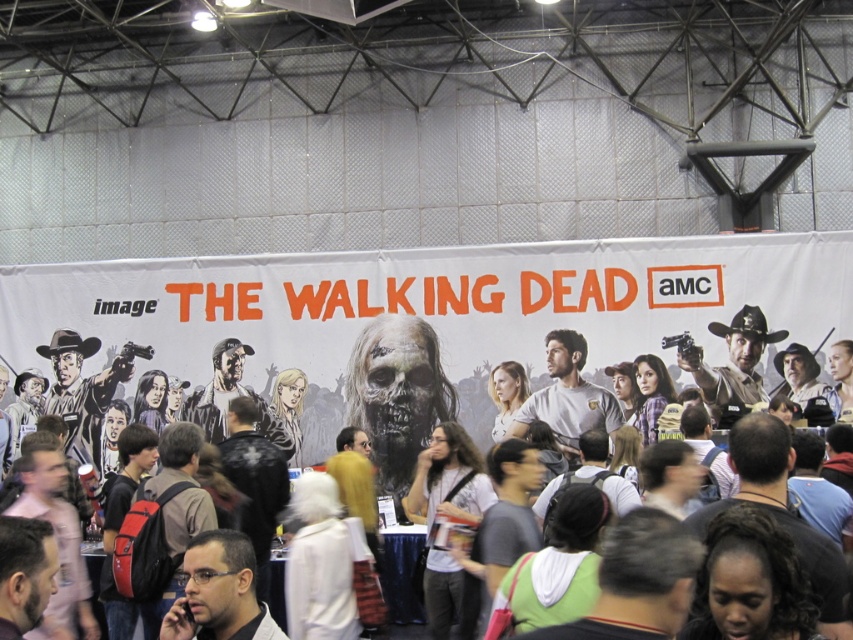
In the scene shown: You are a photographer at the event and want to capture both the white matte banner at center and the matte black backpack at center in the same frame. Which object should you position closer to the camera to ensure both are fully visible?

The white matte banner at center has a lesser height compared to the matte black backpack at center. To ensure both are fully visible in the frame, position the white matte banner at center closer to the camera since it is smaller in height and needs to be enlarged in the photo to match the backpack.

Consider the image. You are a photographer at the event and need to capture a photo that includes both the white matte banner at center and the matte black backpack at center. What is the minimum distance you need to move backward to ensure both objects are in frame?

The white matte banner at center and the matte black backpack at center are 37.80 inches apart. To include both in the frame, the photographer must move back enough to cover this distance within the camera lens field of view.

You are standing at the point marked as point (x=77, y=275) in the image. There is a banner in the background that is 25.93 meters away from you. Can you see the AMC logo on the banner from your current position?

The distance between you and the banner is 25.93 meters. Since the AMC logo is part of the banner, you can see it from your current position.